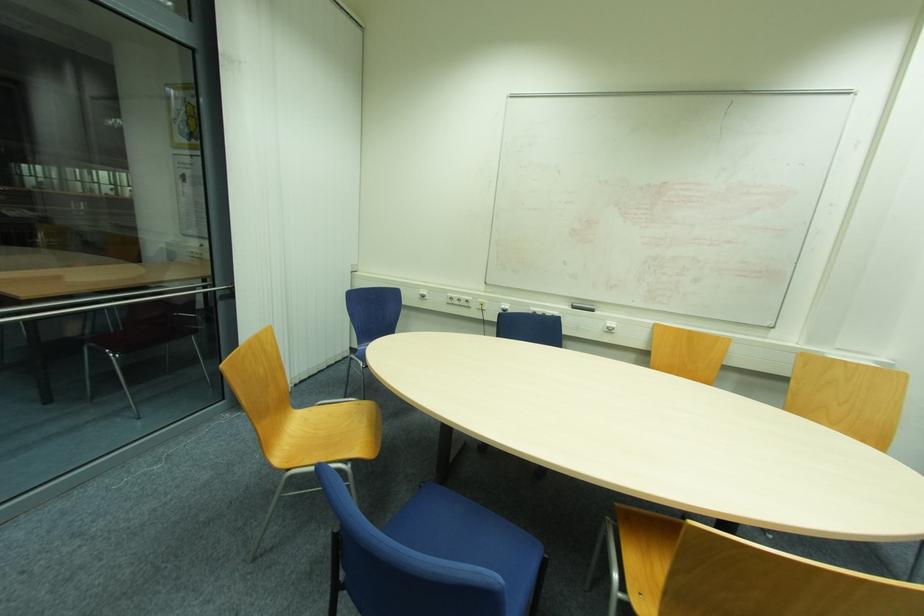
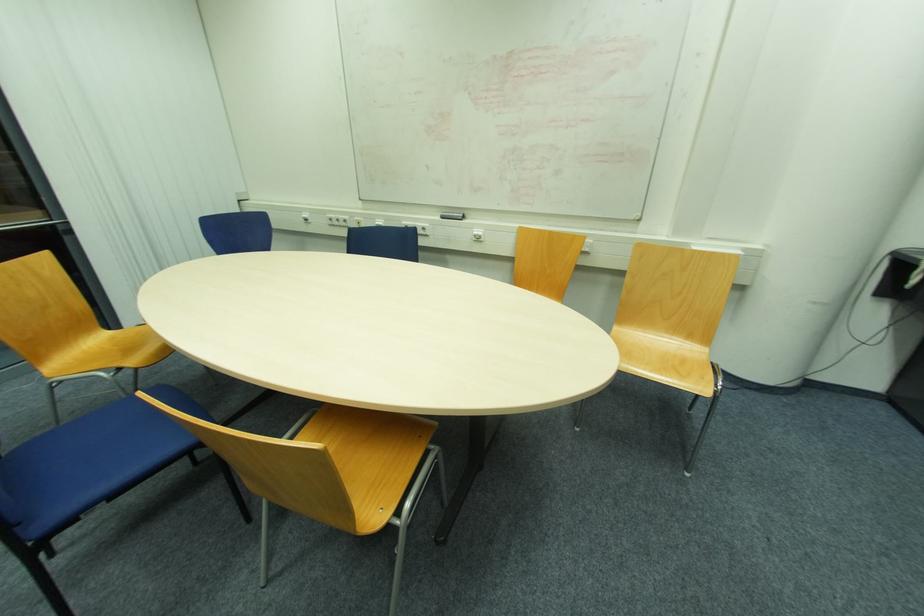
Find the pixel in the second image that matches (x=610, y=325) in the first image.

(477, 233)